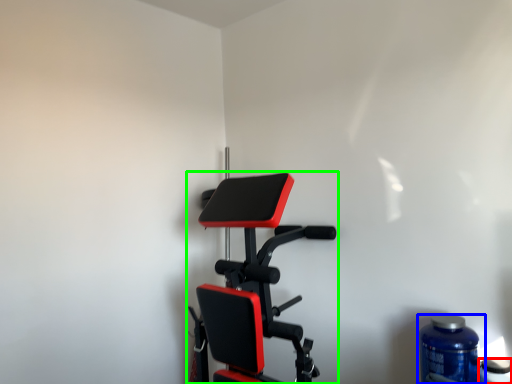
Question: Which object is the closest to the bottle (highlighted by a red box)? Choose among these: bottle (highlighted by a blue box) or stationary bicycle (highlighted by a green box).

Choices:
 (A) bottle
 (B) stationary bicycle

Answer: (A)